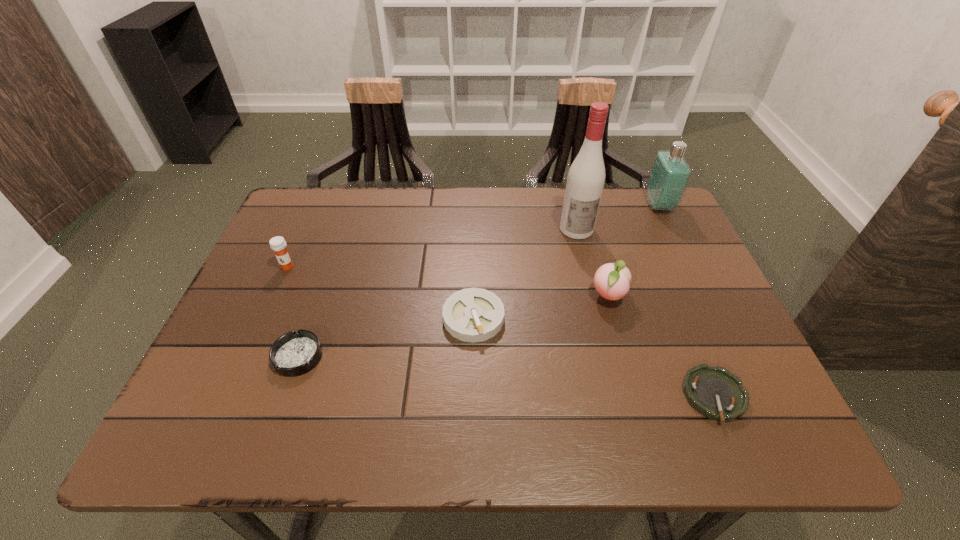
The height and width of the screenshot is (540, 960). Identify the location of object positioned at the near right corner. (716, 393).

Where is `free space at the far edge of the desktop`? This screenshot has height=540, width=960. free space at the far edge of the desktop is located at coordinates (351, 207).

You are a GUI agent. You are given a task and a screenshot of the screen. Output one action in this format:
    pyautogui.click(x=<x>, y=<y>)
    Task: Click on the free space at the near edge
    This screenshot has width=960, height=540.
    Given the screenshot: What is the action you would take?
    pyautogui.click(x=354, y=406)

In the image, there is a desktop. Where is `vacant region at the left edge`? The image size is (960, 540). vacant region at the left edge is located at coordinates point(253,383).

Find the location of `free space at the right edge of the desktop`. free space at the right edge of the desktop is located at coordinates (692, 298).

Find the location of `vacant area at the far left corner`. vacant area at the far left corner is located at coordinates (330, 212).

This screenshot has height=540, width=960. In the image, there is a desktop. Find the location of `free region at the far right corner`. free region at the far right corner is located at coordinates (682, 231).

Find the location of `vacant space at the near right corner`. vacant space at the near right corner is located at coordinates (785, 447).

Where is `unoccupied position between the second shortest ashtray and the sixth shortest object`? This screenshot has height=540, width=960. unoccupied position between the second shortest ashtray and the sixth shortest object is located at coordinates (x=479, y=281).

Locate an element on the screen. The image size is (960, 540). free space between the fifth object from right to left and the leftmost ashtray is located at coordinates (386, 337).